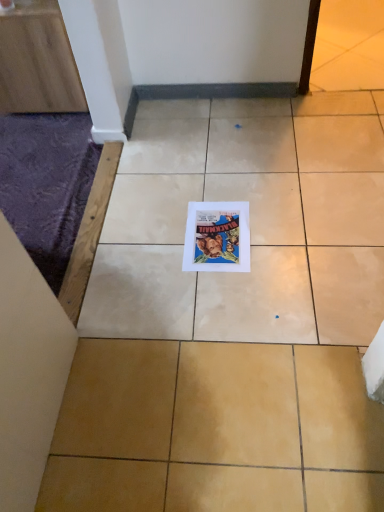
You are a GUI agent. You are given a task and a screenshot of the screen. Output one action in this format:
    pyautogui.click(x=<x>, y=<y>)
    Task: Click on the unoccupied space behind matte paper comic book at center
    
    Given the screenshot: What is the action you would take?
    (x=212, y=186)